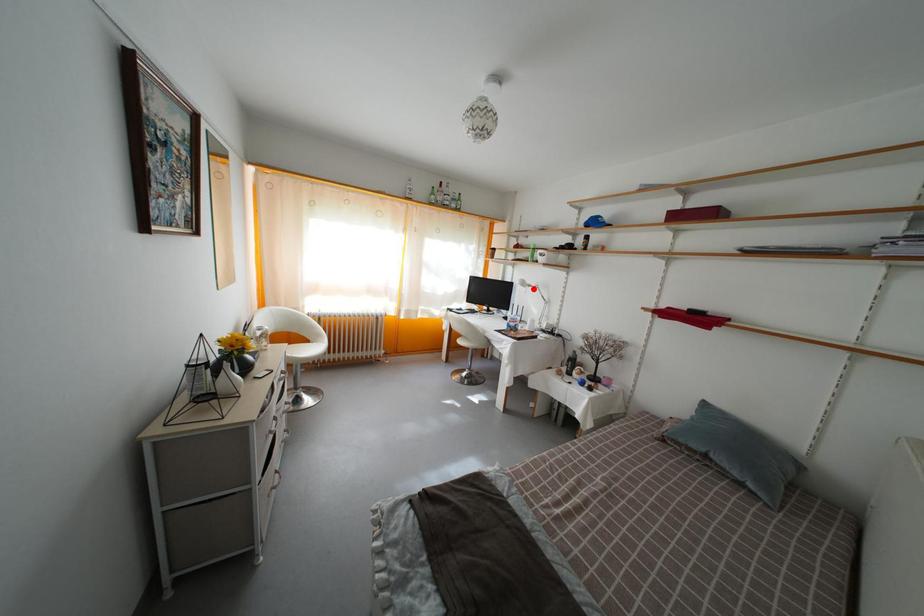
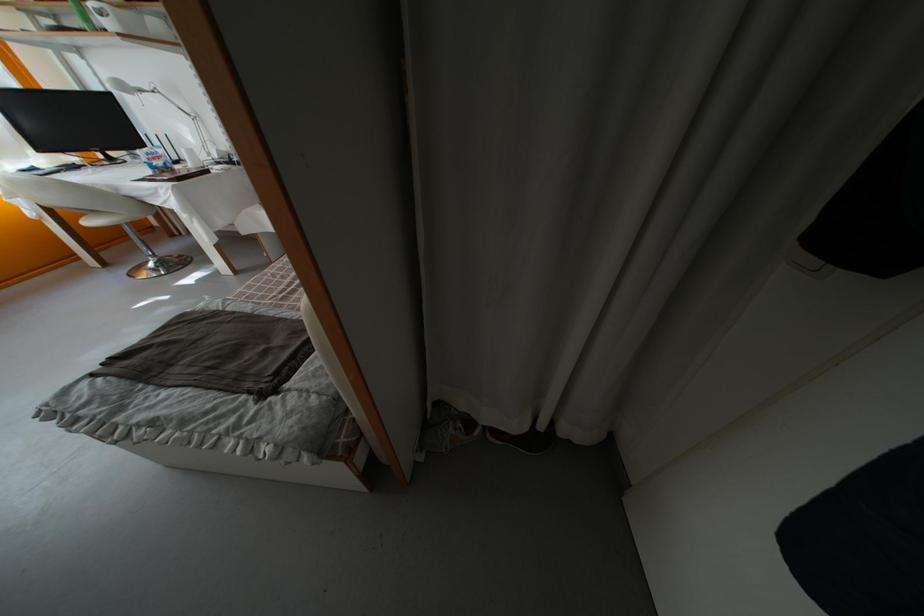
Where in the second image is the point corresponding to the highlighted location from the first image?

(139, 91)